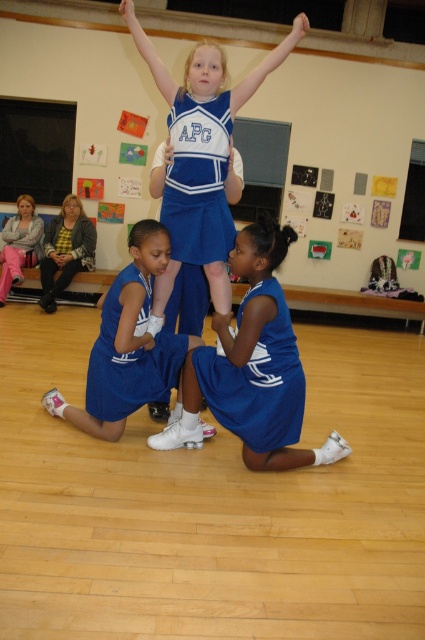
Question: Among these points, which one is farthest from the camera?

Choices:
 (A) (3, 272)
 (B) (136, 227)

Answer: (A)

Question: Which of these objects is positioned farthest from the blue fabric dress at center?

Choices:
 (A) blue fabric uniform at center
 (B) matte blue uniform at lower left
 (C) blue jersey at center

Answer: (B)

Question: Which point is farther to the camera?

Choices:
 (A) blue fabric cheerleader at center
 (B) blue fabric dress at center

Answer: (A)

Question: Can you confirm if blue fabric uniform at lower center is positioned above matte blue uniform at lower left?

Choices:
 (A) no
 (B) yes

Answer: (A)

Question: Does blue fabric cheerleader at center come in front of matte blue cheerleading uniform at center?

Choices:
 (A) no
 (B) yes

Answer: (B)

Question: Is matte blue cheerleading uniform at center to the right of blue jersey at center from the viewer's perspective?

Choices:
 (A) no
 (B) yes

Answer: (B)